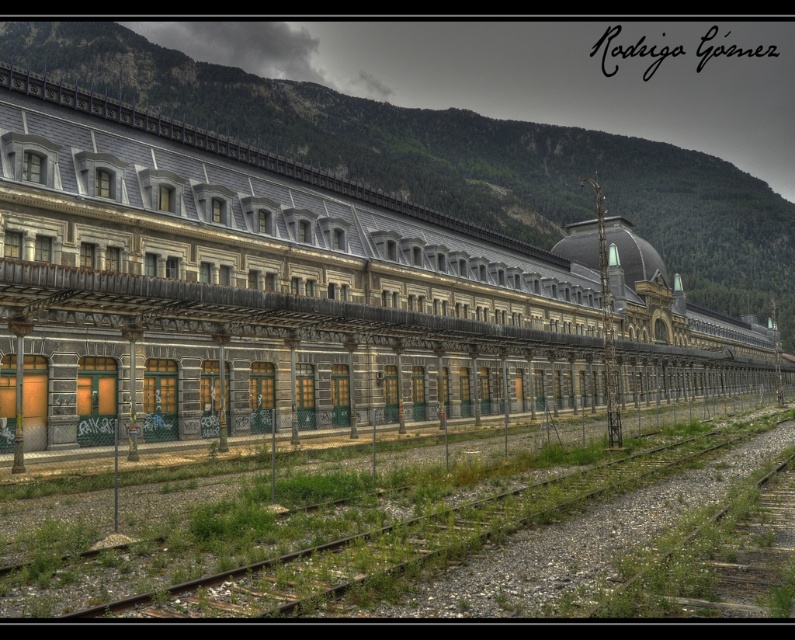
You are standing at the entrance of the historic railway station and notice two points marked on the roofline. The first point is at coordinates point (673, 296) and the second is at point (640, 440). From your vantage point, which point appears closer to you?

Point (640, 440) appears closer because point (673, 296) is behind it.

In the scene shown: You are a photographer planning to take a photo of the stone train at center and the gravelly metal train track at lower left. Considering their sizes, which object should you focus on to ensure both are clearly visible in the frame?

The stone train at center is larger in size compared to the gravelly metal train track at lower left. To ensure both are clearly visible, focus on the stone train at center as it occupies more space in the frame, allowing the smaller gravelly metal train track at lower left to be captured alongside without overcrowding.